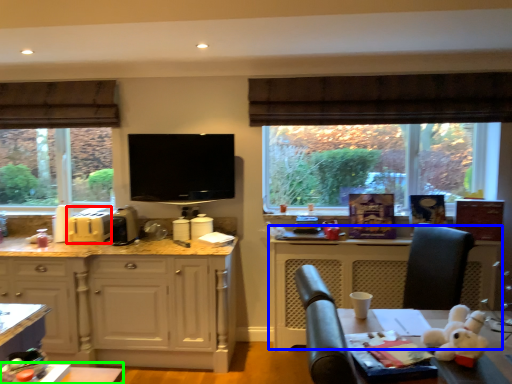
Question: Which object is positioned closest to appliance (highlighted by a red box)? Select from counter (highlighted by a blue box) and table (highlighted by a green box).

Choices:
 (A) counter
 (B) table

Answer: (B)